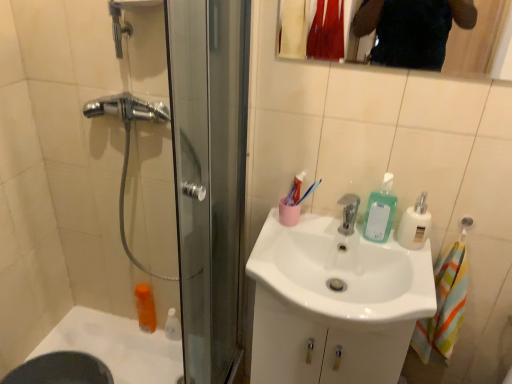
This screenshot has height=384, width=512. Identify the location of vacant area that is in front of white plastic soap dispenser at upper right, placed as the first soap dispenser when sorted from right to left. (417, 274).